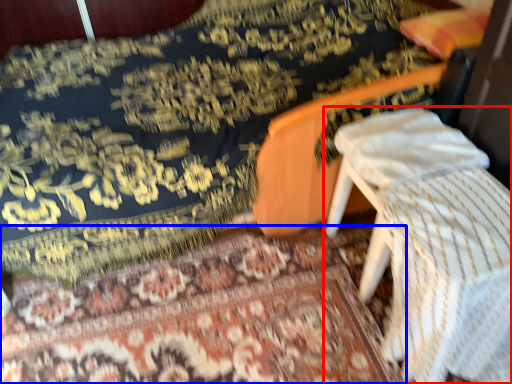
Question: Among these objects, which one is nearest to the camera, furniture (highlighted by a red box) or mat (highlighted by a blue box)?

Choices:
 (A) furniture
 (B) mat

Answer: (A)